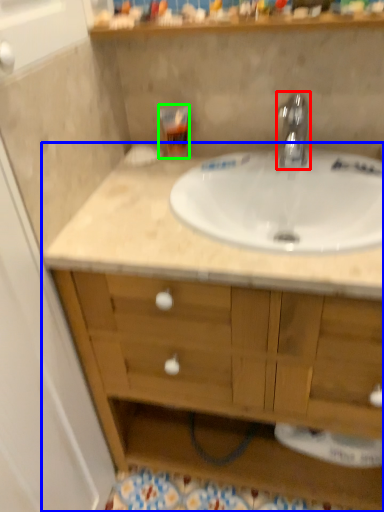
Question: Based on their relative distances, which object is nearer to tap (highlighted by a red box)? Choose from bathroom cabinet (highlighted by a blue box) and toiletry (highlighted by a green box).

Choices:
 (A) bathroom cabinet
 (B) toiletry

Answer: (B)